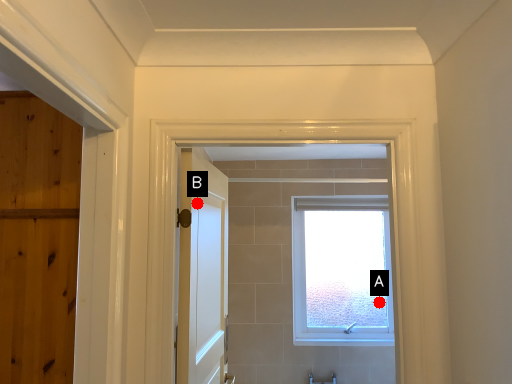
Question: Two points are circled on the image, labeled by A and B beside each circle. Which point is farther from the camera taking this photo?

Choices:
 (A) A is further
 (B) B is further

Answer: (A)